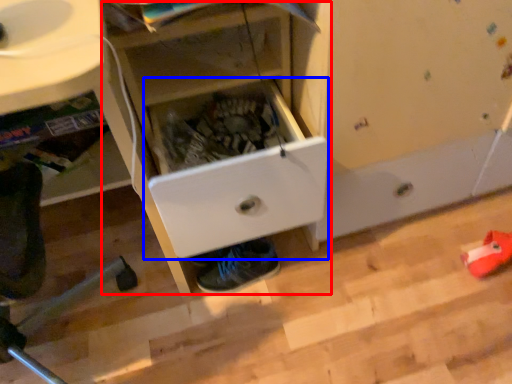
Question: Which point is further to the camera, cabinetry (highlighted by a red box) or drawer (highlighted by a blue box)?

Choices:
 (A) cabinetry
 (B) drawer

Answer: (B)